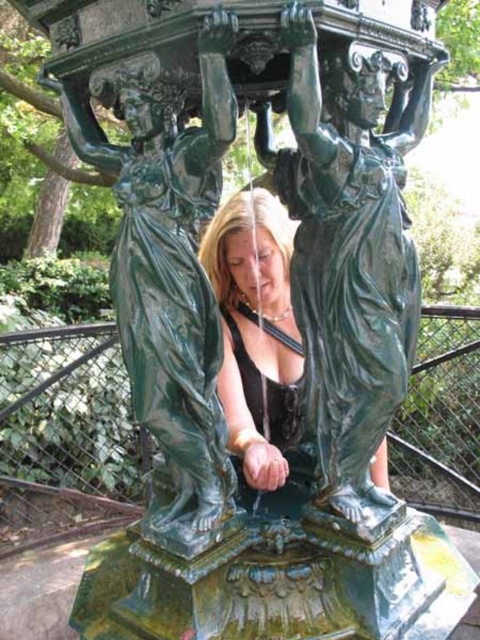
Question: Which point appears closest to the camera in this image?

Choices:
 (A) (300, 96)
 (B) (262, 259)

Answer: (A)

Question: Can you confirm if green polished statue at center is bigger than shiny green statue at center?

Choices:
 (A) no
 (B) yes

Answer: (B)

Question: Among these objects, which one is nearest to the camera?

Choices:
 (A) green polished statue at center
 (B) shiny green statue at center

Answer: (A)

Question: Can you confirm if green polished statue at center is thinner than shiny green statue at center?

Choices:
 (A) yes
 (B) no

Answer: (B)

Question: Does green polished statue at center appear under shiny green statue at center?

Choices:
 (A) no
 (B) yes

Answer: (A)

Question: Which point is closer to the camera?

Choices:
 (A) (236, 356)
 (B) (345, 282)

Answer: (B)